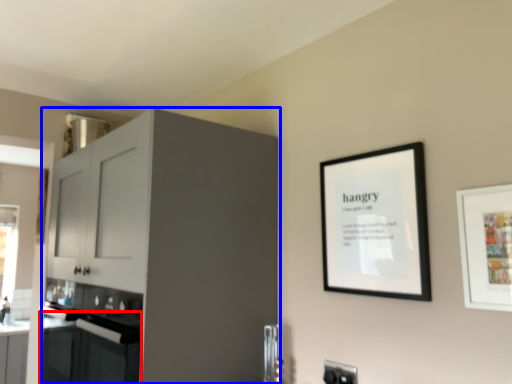
Question: Which of the following is the closest to the observer, oven (highlighted by a red box) or cabinetry (highlighted by a blue box)?

Choices:
 (A) oven
 (B) cabinetry

Answer: (B)